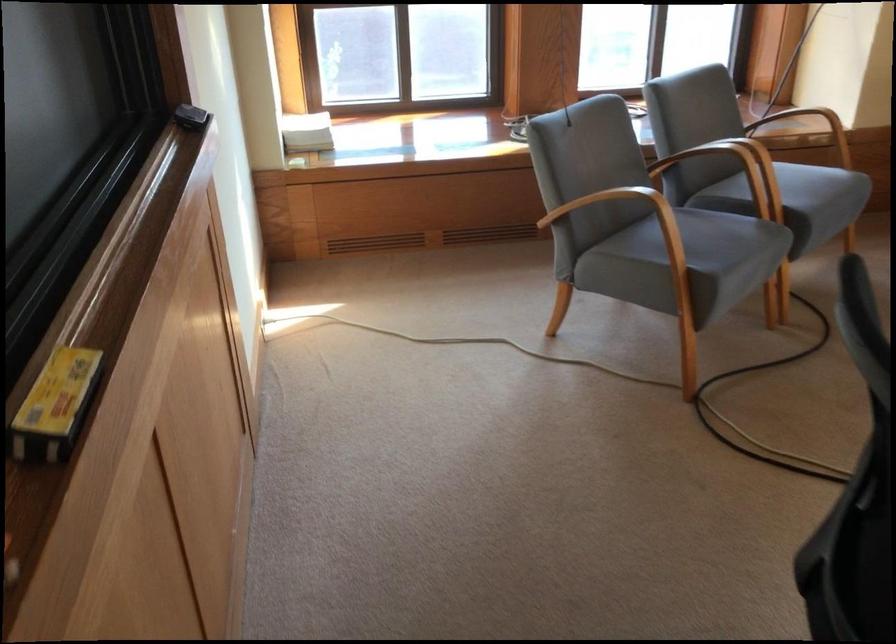
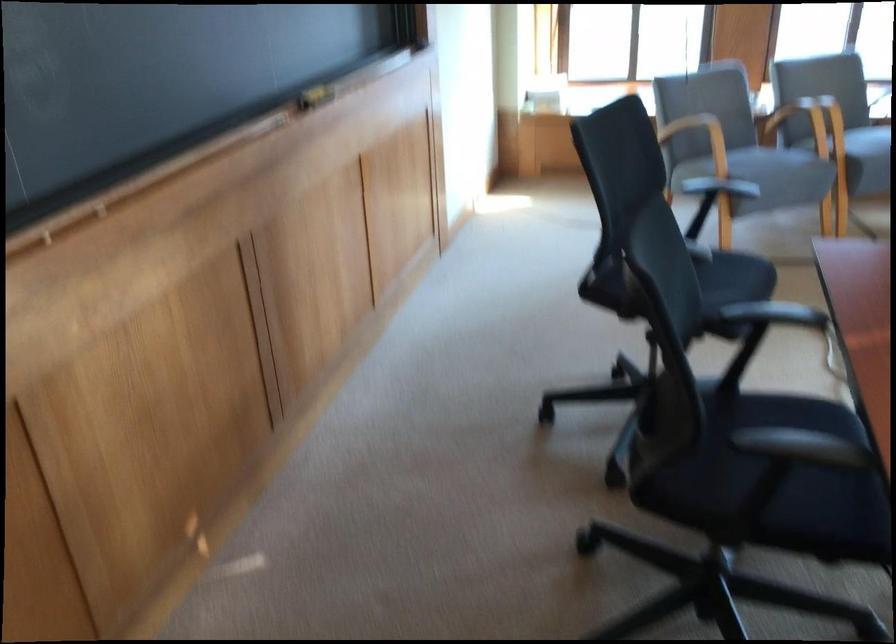
Locate, in the second image, the point that corresponds to (x=607, y=227) in the first image.

(700, 138)